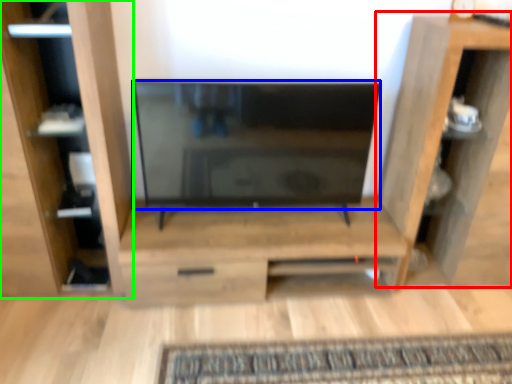
Question: Which is farther away from shelf (highlighted by a red box)? screen (highlighted by a blue box) or furniture (highlighted by a green box)?

Choices:
 (A) screen
 (B) furniture

Answer: (B)